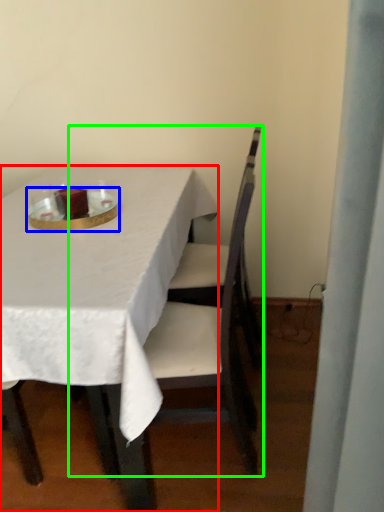
Question: Which object is the farthest from table (highlighted by a red box)? Choose among these: tableware (highlighted by a blue box) or chair (highlighted by a green box).

Choices:
 (A) tableware
 (B) chair

Answer: (B)